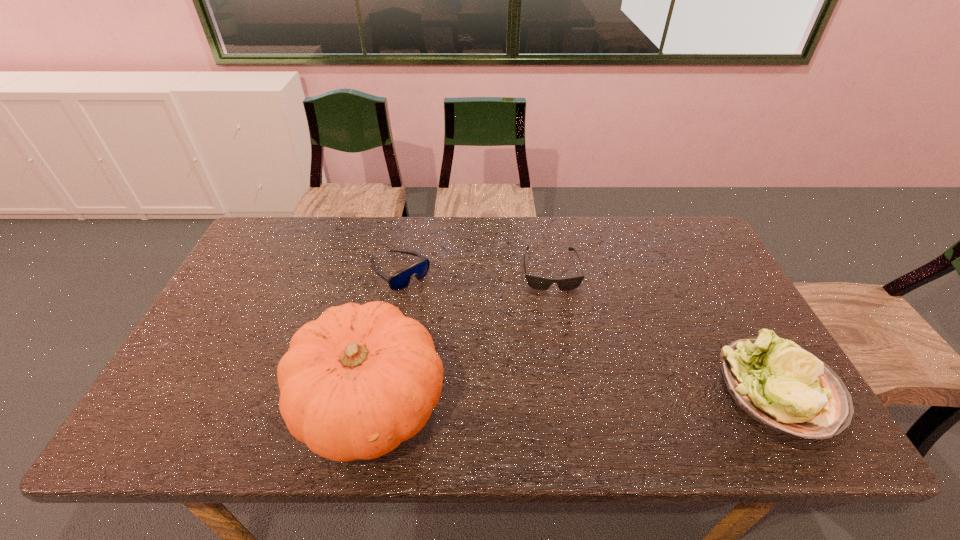
Image resolution: width=960 pixels, height=540 pixels. I want to click on free area in between the rightmost object and the third object from left to right, so click(x=665, y=329).

Image resolution: width=960 pixels, height=540 pixels. Identify the location of free space that is in between the right sunglasses and the tallest object. (461, 337).

The height and width of the screenshot is (540, 960). Find the location of `vacant space that's between the third shortest object and the right sunglasses`. vacant space that's between the third shortest object and the right sunglasses is located at coordinates (665, 329).

Choose which object is the second nearest neighbor to the second tallest object. Please provide its 2D coordinates. Your answer should be formatted as a tuple, i.e. [(x, y)], where the tuple contains the x and y coordinates of a point satisfying the conditions above.

[(355, 383)]

Identify which object is the third closest to the third shortest object. Please provide its 2D coordinates. Your answer should be formatted as a tuple, i.e. [(x, y)], where the tuple contains the x and y coordinates of a point satisfying the conditions above.

[(400, 280)]

Locate an element on the screen. This screenshot has height=540, width=960. vacant region that satisfies the following two spatial constraints: 1. on the front side of the rightmost object; 2. on the left side of the left sunglasses is located at coordinates (376, 389).

Identify the location of free space that satisfies the following two spatial constraints: 1. on the back side of the pumpkin; 2. on the left side of the second tallest object. The image size is (960, 540). (374, 389).

At what (x,y) coordinates should I click in order to perform the action: click on vacant space that satisfies the following two spatial constraints: 1. on the back side of the shorter sunglasses; 2. on the left side of the tallest object. Please return your answer as a coordinate pair (x, y). The image size is (960, 540). Looking at the image, I should click on (398, 270).

I want to click on vacant area that satisfies the following two spatial constraints: 1. on the back side of the tallest object; 2. on the right side of the taller sunglasses, so click(397, 271).